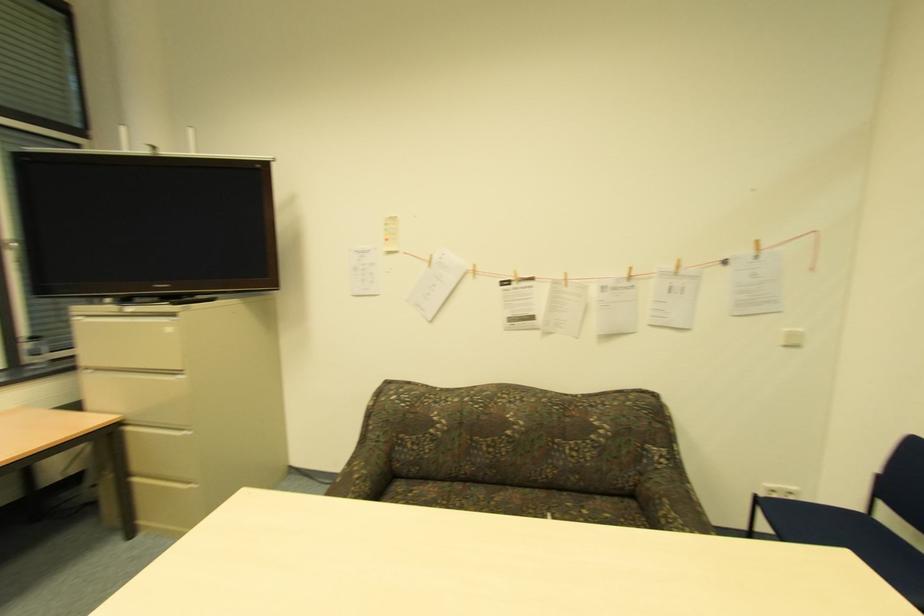
Find the location of a particular element. This screenshot has height=616, width=924. chair sitting surface is located at coordinates (880, 549).